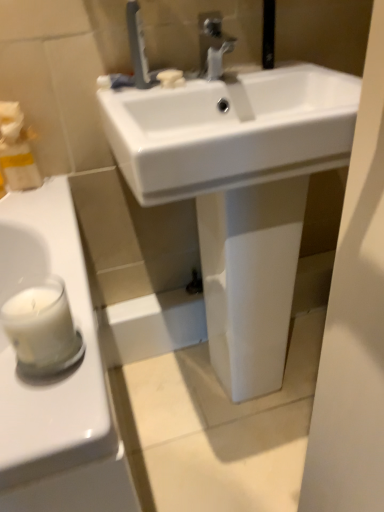
Question: Would you consider white wax candle at left to be distant from satin nickel faucet at upper center, which is the second tap from right to left?

Choices:
 (A) yes
 (B) no

Answer: (B)

Question: Considering the relative sizes of white wax candle at left and satin nickel faucet at upper center, which is the second tap from right to left, in the image provided, is white wax candle at left smaller than satin nickel faucet at upper center, which is the second tap from right to left,?

Choices:
 (A) yes
 (B) no

Answer: (B)

Question: Is white wax candle at left beside satin nickel faucet at upper center, which is the second tap from right to left?

Choices:
 (A) yes
 (B) no

Answer: (B)

Question: From the image's perspective, is white wax candle at left below satin nickel faucet at upper center, the 1th tap positioned from the left?

Choices:
 (A) no
 (B) yes

Answer: (B)

Question: From the image's perspective, is white wax candle at left on top of satin nickel faucet at upper center, the 1th tap positioned from the left?

Choices:
 (A) no
 (B) yes

Answer: (A)

Question: Is white wax candle at left positioned before satin nickel faucet at upper center, the 1th tap positioned from the left?

Choices:
 (A) no
 (B) yes

Answer: (B)

Question: From a real-world perspective, is white matte soap at center positioned under white wax candle at left based on gravity?

Choices:
 (A) no
 (B) yes

Answer: (A)

Question: Is white matte soap at center smaller than white wax candle at left?

Choices:
 (A) yes
 (B) no

Answer: (A)

Question: Does white matte soap at center appear on the right side of white wax candle at left?

Choices:
 (A) yes
 (B) no

Answer: (A)

Question: Are white matte soap at center and white wax candle at left making contact?

Choices:
 (A) yes
 (B) no

Answer: (B)

Question: Is white matte soap at center looking in the opposite direction of white wax candle at left?

Choices:
 (A) yes
 (B) no

Answer: (B)

Question: From a real-world perspective, is white matte soap at center located higher than white wax candle at left?

Choices:
 (A) no
 (B) yes

Answer: (B)

Question: Is satin nickel faucet at upper center, which is the second tap from right to left, located within white glossy sink at center?

Choices:
 (A) yes
 (B) no

Answer: (B)